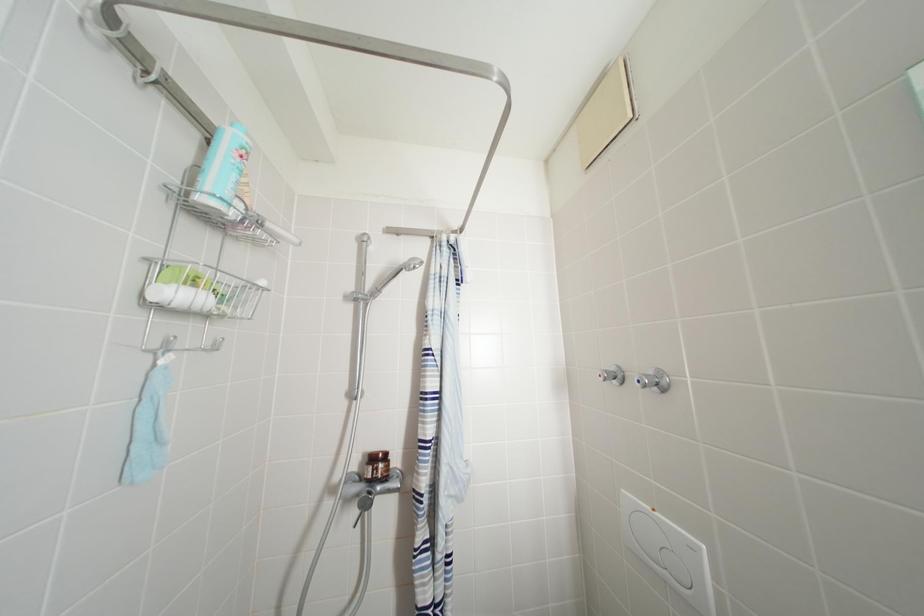
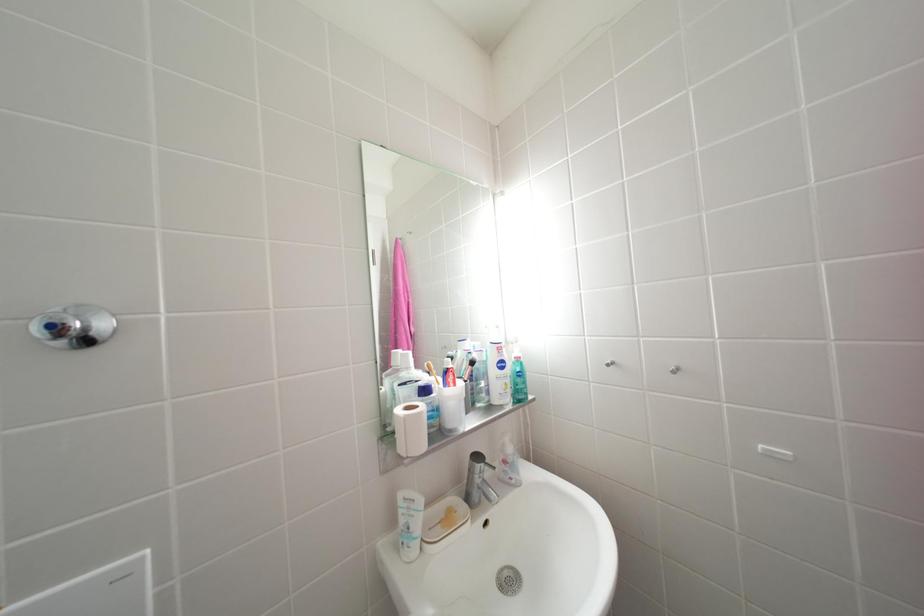
Question: The images are taken continuously from a first-person perspective. In which direction is your viewpoint rotating?

Choices:
 (A) Left
 (B) Right
 (C) Up
 (D) Down

Answer: (B)